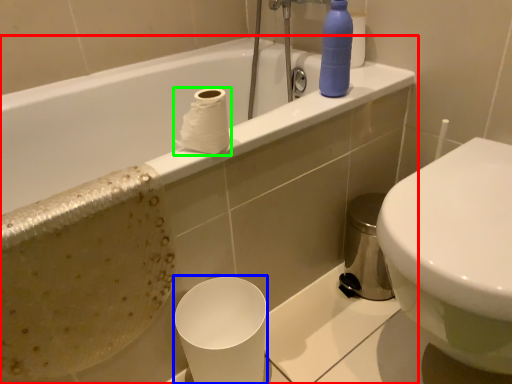
Question: Which object is positioned farthest from bathtub (highlighted by a red box)? Select from paper cup (highlighted by a blue box) and toilet paper (highlighted by a green box).

Choices:
 (A) paper cup
 (B) toilet paper

Answer: (B)